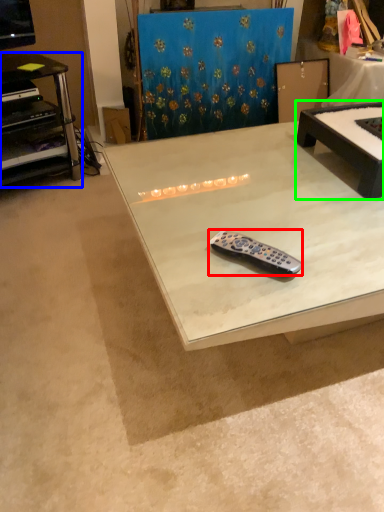
Question: Estimate the real-world distances between objects in this image. Which object is farther from remote control (highlighted by a red box), desk (highlighted by a blue box) or table (highlighted by a green box)?

Choices:
 (A) desk
 (B) table

Answer: (A)